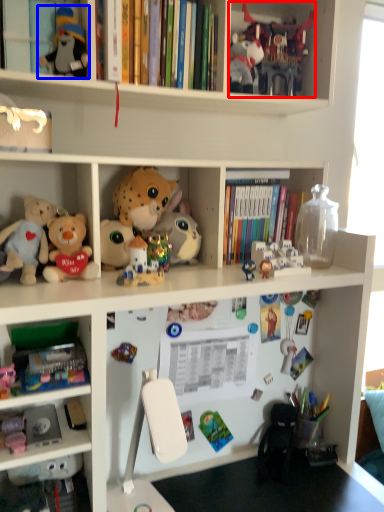
Question: Which of the following is the closest to the observer, toy (highlighted by a red box) or toy (highlighted by a blue box)?

Choices:
 (A) toy
 (B) toy

Answer: (B)